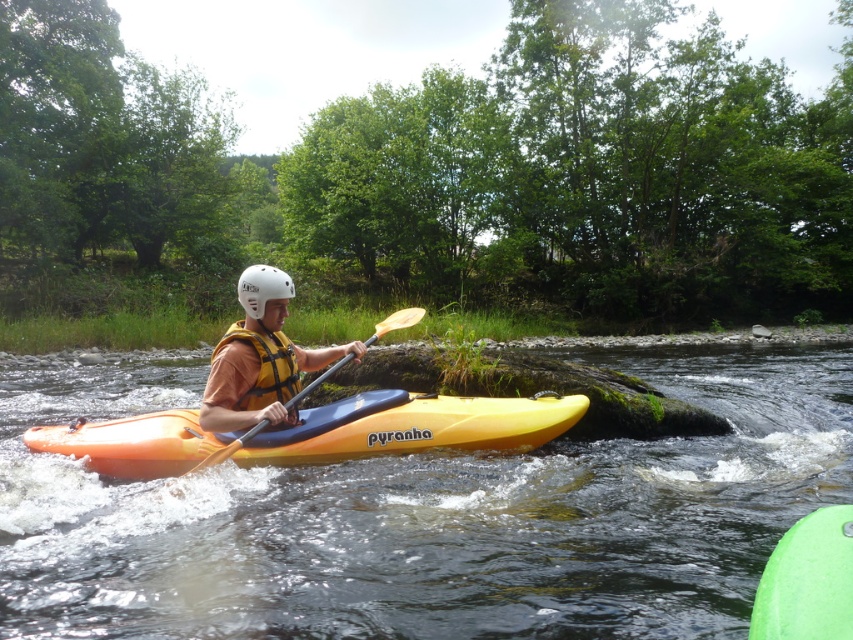
Who is lower down, orange matte kayak at center or white matte helmet at center?

orange matte kayak at center

Which of these two, orange matte kayak at center or white matte helmet at center, stands taller?

white matte helmet at center

Which is behind, point (514, 408) or point (253, 285)?

Point (514, 408)

Locate an element on the screen. orange matte kayak at center is located at coordinates (x=412, y=426).

Does orange plastic kayak at center have a greater width compared to yellow/yellowish-orange fabric life jacket at center?

Correct, the width of orange plastic kayak at center exceeds that of yellow/yellowish-orange fabric life jacket at center.

Who is more forward, (370, 524) or (248, 392)?

Point (370, 524) is more forward.

At what (x,y) coordinates should I click in order to perform the action: click on orange plastic kayak at center. Please return your answer as a coordinate pair (x, y). The width and height of the screenshot is (853, 640). Looking at the image, I should click on (427, 516).

I want to click on orange plastic kayak at center, so click(x=427, y=516).

Measure the distance from orange plastic kayak at center to white matte helmet at center.

6.86 meters

In the scene shown: Is orange plastic kayak at center behind white matte helmet at center?

That is False.

Is point (88, 472) positioned before point (281, 284)?

No, it is behind (281, 284).

What are the coordinates of `orange plastic kayak at center` in the screenshot? It's located at pos(427,516).